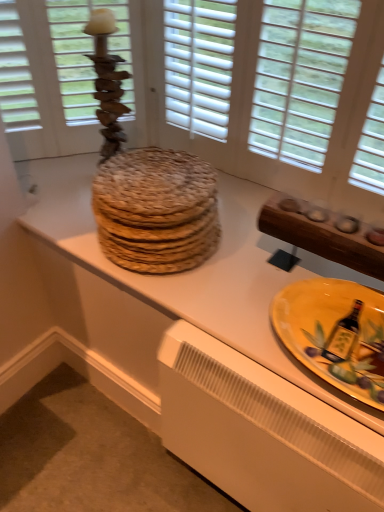
Identify the location of free spot above white plastic radiator at lower center (from a real-world perspective). The width and height of the screenshot is (384, 512). (283, 395).